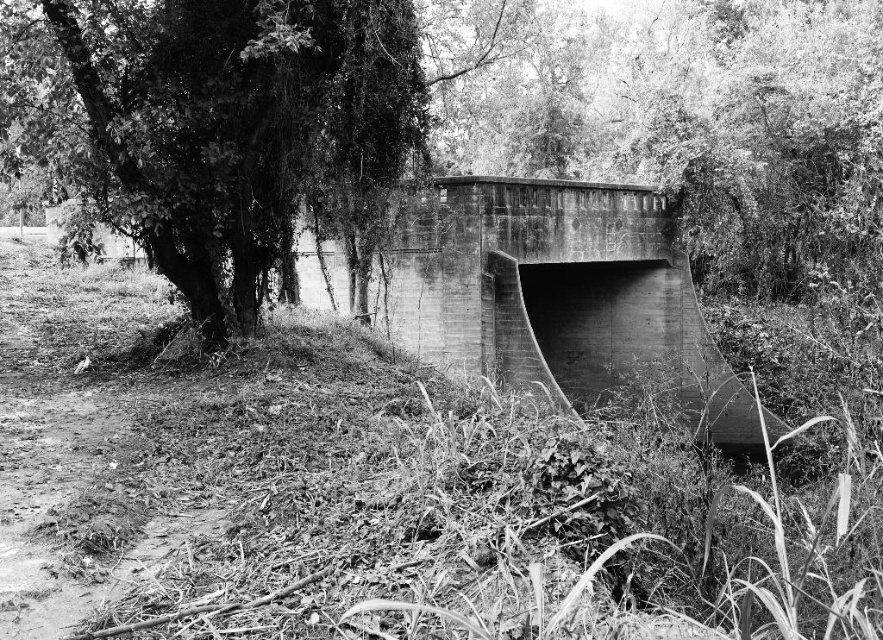
You are a landscape architect assessing a site for a new pathway. You notice the green leafy tree at left and the concrete bridge at center. Which object takes up more area in the scene?

The concrete bridge at center occupies more area than the green leafy tree at left.

You are a hiker who wants to cross the concrete bridge at center. However, you notice the green leafy tree at left might block your path. Based on the scene description, can you determine if the tree is tall enough to interfere with your passage?

The green leafy tree at left is shorter than the concrete bridge at center, so it is unlikely to block your path when crossing the bridge.